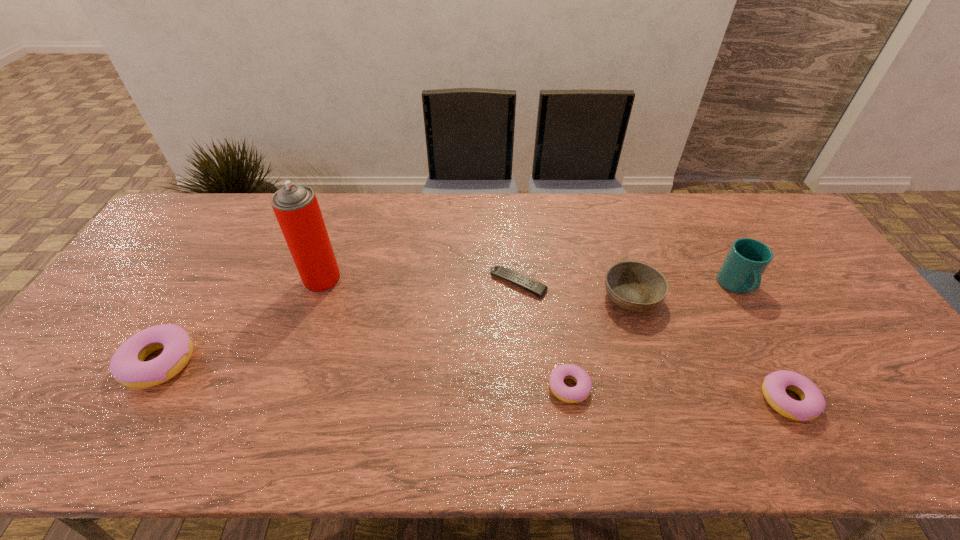
The height and width of the screenshot is (540, 960). Identify the location of vacant position at the far edge of the desktop. (505, 237).

Where is `vacant space at the near edge`? The height and width of the screenshot is (540, 960). vacant space at the near edge is located at coordinates (240, 382).

Image resolution: width=960 pixels, height=540 pixels. Find the location of `vacant region at the left edge of the desktop`. vacant region at the left edge of the desktop is located at coordinates (127, 332).

The width and height of the screenshot is (960, 540). In the image, there is a desktop. Identify the location of free space at the right edge. (839, 335).

In the image, there is a desktop. Where is `vacant space at the near left corner`? vacant space at the near left corner is located at coordinates (21, 410).

At what (x,y) coordinates should I click in order to perform the action: click on vacant space at the near right corner of the desktop. Please return your answer as a coordinate pair (x, y). The image size is (960, 540). Looking at the image, I should click on (882, 401).

This screenshot has height=540, width=960. Identify the location of vacant area that lies between the fifth tallest object and the shortest object. [653, 342].

The height and width of the screenshot is (540, 960). Find the location of `vacant area that lies between the third object from right to left and the cup`. vacant area that lies between the third object from right to left and the cup is located at coordinates (684, 292).

You are a GUI agent. You are given a task and a screenshot of the screen. Output one action in this format:
    pyautogui.click(x=<x>, y=<y>)
    Task: Click on the empty location between the third shortest object and the second tallest object
    The image size is (960, 540).
    Given the screenshot: What is the action you would take?
    pyautogui.click(x=762, y=343)

The image size is (960, 540). What are the coordinates of `empty space between the second doughnut from right to left and the second tallest object` in the screenshot? It's located at (653, 337).